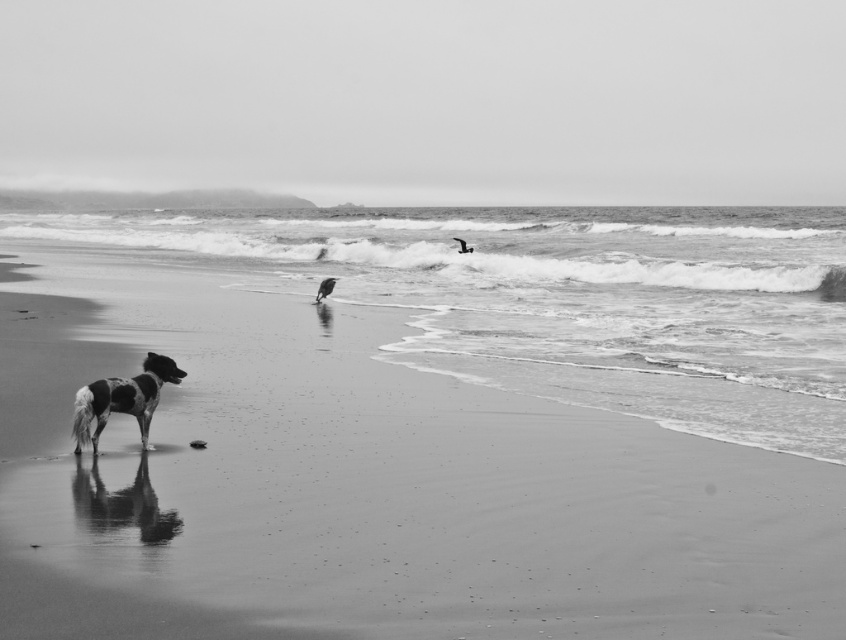
You are a photographer trying to capture the spotted fur dog at lower left and the smooth feathered bird at center in the same frame. Based on their sizes, which one would appear larger in your photo?

The spotted fur dog at lower left would appear larger in the photo since its width surpasses that of the smooth feathered bird at center.